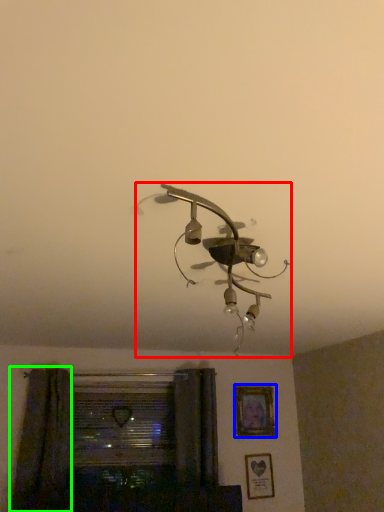
Question: Estimate the real-world distances between objects in this image. Which object is farther from lamp (highlighted by a red box), picture frame (highlighted by a blue box) or curtain (highlighted by a green box)?

Choices:
 (A) picture frame
 (B) curtain

Answer: (A)